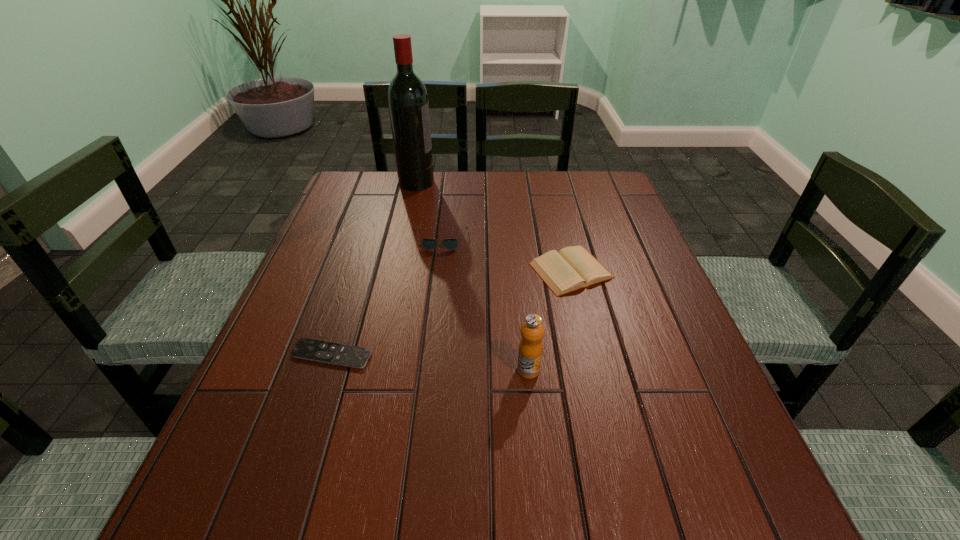
The width and height of the screenshot is (960, 540). In order to click on the farthest object in this screenshot , I will do [408, 104].

Where is `the tallest object`? This screenshot has height=540, width=960. the tallest object is located at coordinates (408, 104).

You are a GUI agent. You are given a task and a screenshot of the screen. Output one action in this format:
    pyautogui.click(x=<x>, y=<y>)
    Task: Click on the orange juice
    The image size is (960, 540).
    Given the screenshot: What is the action you would take?
    pyautogui.click(x=530, y=350)

The height and width of the screenshot is (540, 960). Identify the location of the fourth shortest object. (530, 350).

Where is `sunglasses`? The width and height of the screenshot is (960, 540). sunglasses is located at coordinates (429, 244).

Locate an element on the screen. This screenshot has height=540, width=960. the second shortest object is located at coordinates (572, 268).

Locate an element on the screen. The width and height of the screenshot is (960, 540). the rightmost object is located at coordinates (572, 268).

Where is `remote control`? remote control is located at coordinates pyautogui.click(x=339, y=354).

Locate an element on the screen. free space located 0.320m on the label of the tallest object is located at coordinates (536, 183).

This screenshot has height=540, width=960. Identify the location of vacant space located 0.190m on the front label of the second object from right to left. (540, 481).